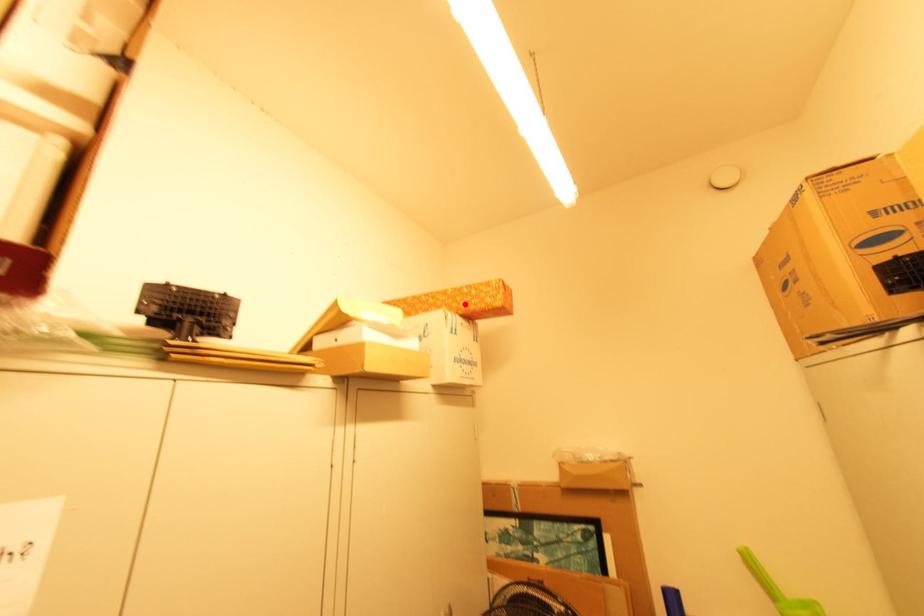
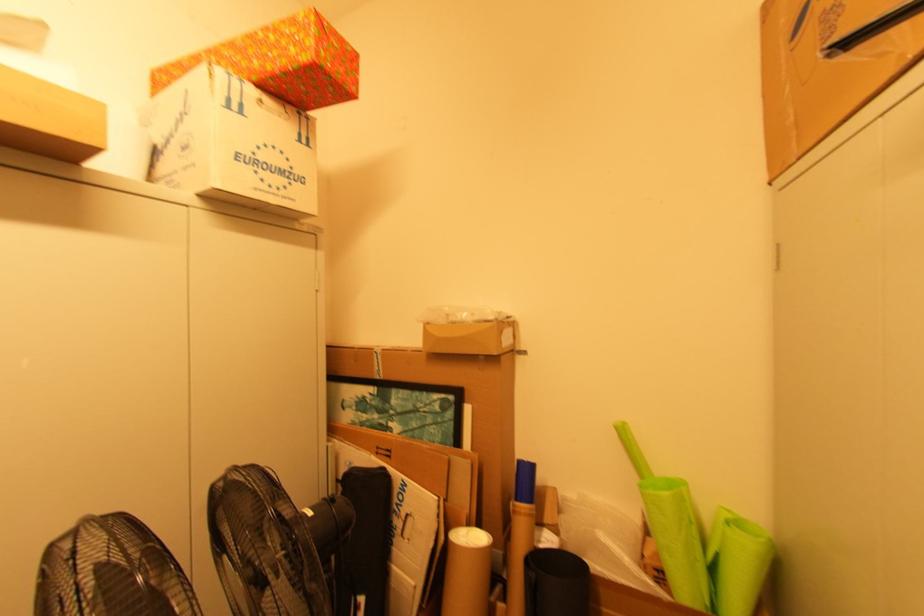
Locate, in the second image, the point that corresponds to the highlighted location in the first image.

(258, 63)